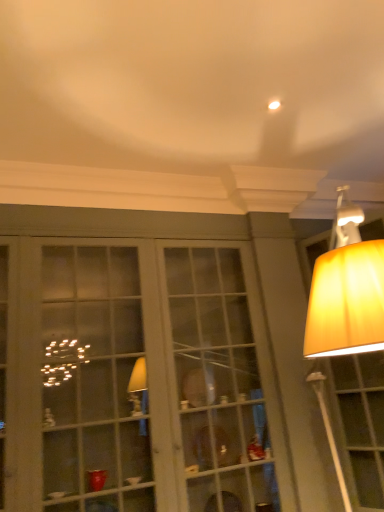
Question: Would you say white glass cabinet at center is to the left or to the right of matte yellow lampshade at upper right in the picture?

Choices:
 (A) left
 (B) right

Answer: (A)

Question: Is white glass cabinet at center in front of or behind matte yellow lampshade at upper right in the image?

Choices:
 (A) behind
 (B) front

Answer: (B)

Question: Is point (147, 468) positioned closer to the camera than point (372, 346)?

Choices:
 (A) closer
 (B) farther

Answer: (B)

Question: Considering the positions of matte yellow lampshade at upper right and white glass cabinet at center in the image, is matte yellow lampshade at upper right wider or thinner than white glass cabinet at center?

Choices:
 (A) thin
 (B) wide

Answer: (A)

Question: From a real-world perspective, relative to white glass cabinet at center, is matte yellow lampshade at upper right vertically above or below?

Choices:
 (A) below
 (B) above

Answer: (A)

Question: Is matte yellow lampshade at upper right in front of or behind white glass cabinet at center in the image?

Choices:
 (A) behind
 (B) front

Answer: (A)

Question: From the image's perspective, is matte yellow lampshade at upper right positioned above or below white glass cabinet at center?

Choices:
 (A) above
 (B) below

Answer: (A)